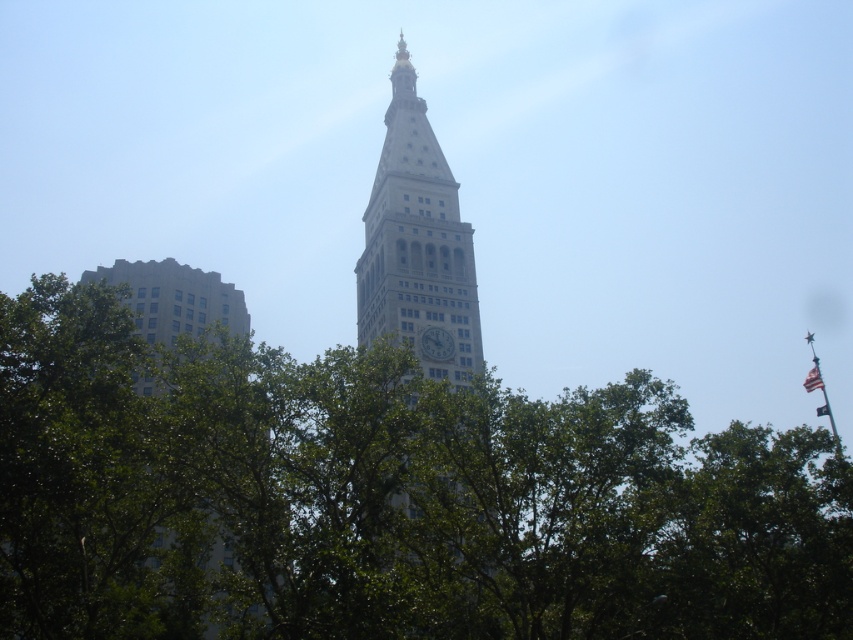
Question: Which point is farther to the camera?

Choices:
 (A) american flag at upper right
 (B) american flag at right
 (C) green leafy tree at center

Answer: (A)

Question: Does green leafy tree at center have a smaller size compared to american flag at right?

Choices:
 (A) yes
 (B) no

Answer: (B)

Question: Is the position of white stone clock tower at center more distant than that of american flag at upper right?

Choices:
 (A) no
 (B) yes

Answer: (A)

Question: Can you confirm if green leafy tree at center is positioned above white stone clock tower at center?

Choices:
 (A) no
 (B) yes

Answer: (A)

Question: Estimate the real-world distances between objects in this image. Which object is closer to the american flag at upper right?

Choices:
 (A) white stone clock tower at center
 (B) green leafy tree at center

Answer: (A)

Question: Which of the following is the farthest from the observer?

Choices:
 (A) american flag at right
 (B) green leafy tree at center

Answer: (A)